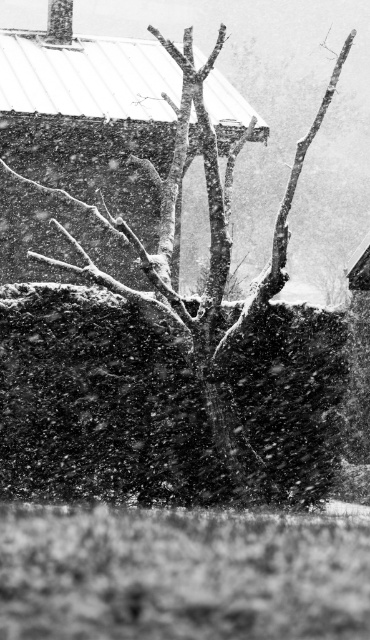
You are standing in the snowy scene looking at the two points marked on the image. Which point, point (308,486) or point (15,253), is nearer to your eyes?

Point (308,486) is closer to the camera than point (15,253), so it is nearer to your eyes.

You are an artist trying to sketch this snowy scene. You want to ensure the smooth bark tree at center is proportionally smaller than the smooth white snow at center. Based on the image, is this already the case?

Yes, the smooth bark tree at center has a lesser width compared to the smooth white snow at center, so it is already proportionally smaller.

You are standing in the snowy scene and want to take a photo of the smooth bark tree at center. If your camera can focus up to 10 meters, will you be able to capture the tree clearly?

The smooth bark tree at center is 12.30 meters away from the camera. Since the camera can only focus up to 10 meters, you will not be able to capture the tree clearly.